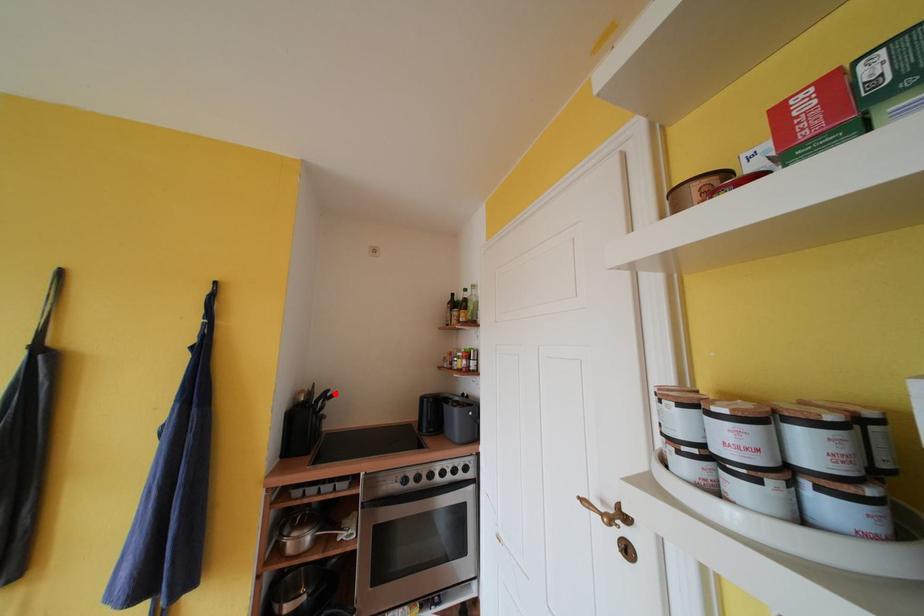
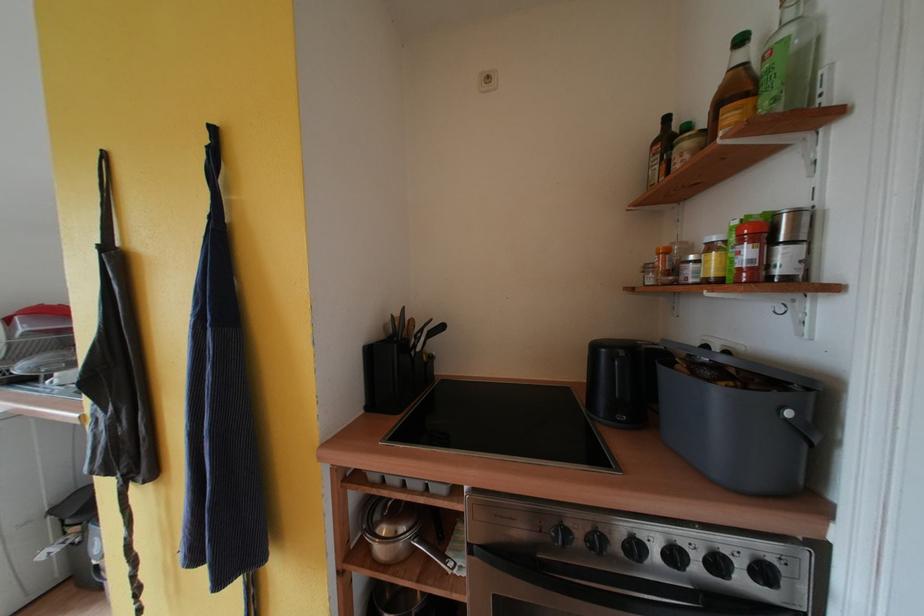
Locate, in the second image, the point that corresponds to the highlighted location in the first image.

(436, 323)